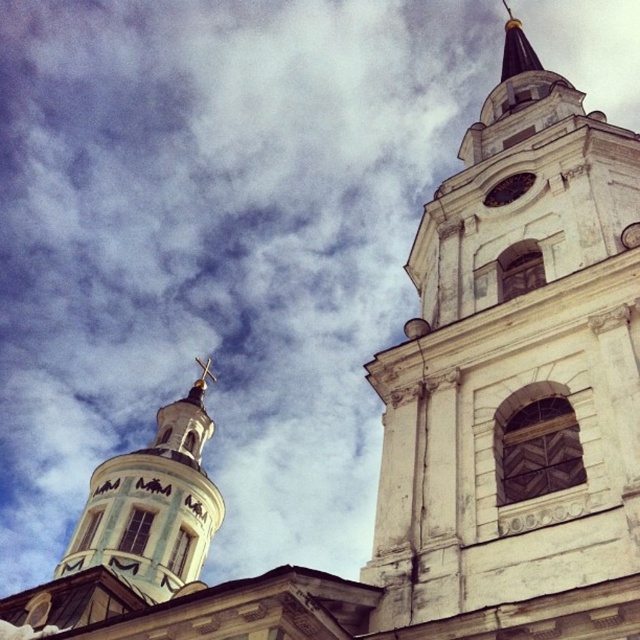
Question: Which point appears closest to the camera in this image?

Choices:
 (A) (502, 52)
 (B) (576, 572)
 (C) (184, 452)
 (D) (506, 195)

Answer: (B)

Question: Is white stone tower at upper right bigger than white painted wood tower at upper left?

Choices:
 (A) yes
 (B) no

Answer: (B)

Question: Which point is closer to the camera?

Choices:
 (A) (531, 180)
 (B) (502, 80)

Answer: (A)

Question: Can you confirm if white painted wood tower at upper left is wider than gold-plated spire at upper right?

Choices:
 (A) no
 (B) yes

Answer: (A)

Question: Is white painted wood tower at upper left smaller than matte white clock at upper center?

Choices:
 (A) no
 (B) yes

Answer: (A)

Question: Among these points, which one is farthest from the camera?

Choices:
 (A) (524, 186)
 (B) (500, 384)

Answer: (A)